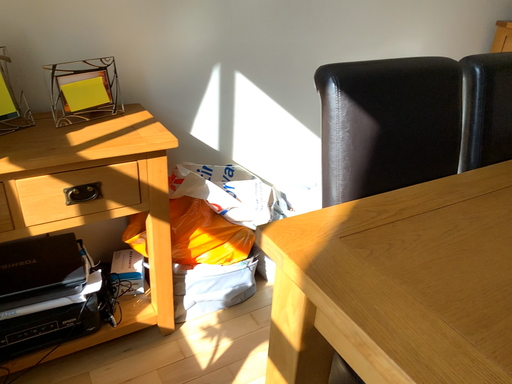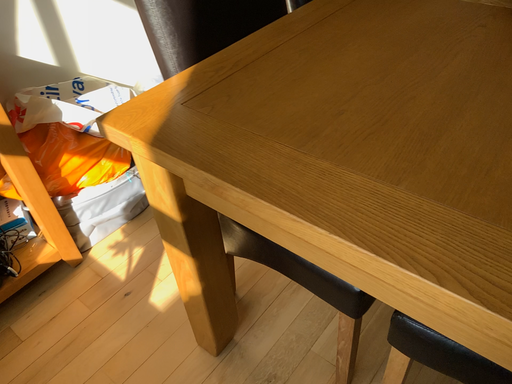
Question: Which way did the camera rotate in the video?

Choices:
 (A) rotated right
 (B) rotated left

Answer: (A)